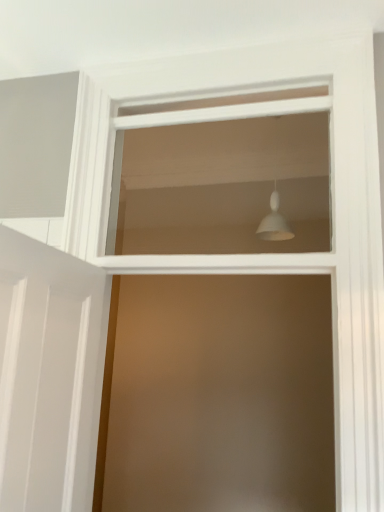
The image size is (384, 512). What are the coordinates of `white matte light fixture at upper center` in the screenshot? It's located at (274, 222).

Describe the element at coordinates (274, 222) in the screenshot. I see `white matte light fixture at upper center` at that location.

What do you see at coordinates (222, 176) in the screenshot? The height and width of the screenshot is (512, 384). I see `white matte lampshade at upper center` at bounding box center [222, 176].

The height and width of the screenshot is (512, 384). Identify the location of white matte lampshade at upper center. (222, 176).

I want to click on white matte light fixture at upper center, so click(x=274, y=222).

Would you say white matte lampshade at upper center is to the left or to the right of white matte light fixture at upper center in the picture?

From the image, it's evident that white matte lampshade at upper center is to the left of white matte light fixture at upper center.

Relative to white matte light fixture at upper center, is white matte lampshade at upper center in front or behind?

white matte lampshade at upper center is positioned closer to the viewer than white matte light fixture at upper center.

Considering the positions of points (250, 122) and (270, 228), is point (250, 122) farther from camera compared to point (270, 228)?

Yes, point (250, 122) is farther from viewer.

From the image's perspective, is white matte lampshade at upper center located beneath white matte light fixture at upper center?

Yes, from the image's perspective, white matte lampshade at upper center is below white matte light fixture at upper center.

From a real-world perspective, does white matte lampshade at upper center stand above white matte light fixture at upper center?

No, from a real-world perspective, white matte lampshade at upper center is not on top of white matte light fixture at upper center.

Considering the relative sizes of white matte lampshade at upper center and white matte light fixture at upper center in the image provided, is white matte lampshade at upper center wider than white matte light fixture at upper center?

Incorrect, the width of white matte lampshade at upper center does not surpass that of white matte light fixture at upper center.

Consider the image. Is white matte lampshade at upper center shorter than white matte light fixture at upper center?

In fact, white matte lampshade at upper center may be taller than white matte light fixture at upper center.

Considering the sizes of objects white matte lampshade at upper center and white matte light fixture at upper center in the image provided, who is smaller, white matte lampshade at upper center or white matte light fixture at upper center?

Smaller between the two is white matte light fixture at upper center.

Can white matte light fixture at upper center be found inside white matte lampshade at upper center?

No.

Does white matte lampshade at upper center touch white matte light fixture at upper center?

No, white matte lampshade at upper center is not with white matte light fixture at upper center.

Is white matte lampshade at upper center oriented away from white matte light fixture at upper center?

Correct, white matte lampshade at upper center is looking away from white matte light fixture at upper center.

Based on the photo, can you tell me how much white matte lampshade at upper center and white matte light fixture at upper center differ in facing direction?

They differ by 1.56 degrees in their facing directions.

The width and height of the screenshot is (384, 512). Find the location of `window below the white matte light fixture at upper center (from the image's perspective)`. window below the white matte light fixture at upper center (from the image's perspective) is located at coordinates (222, 176).

Is white matte light fixture at upper center to the left or to the right of white matte lampshade at upper center in the image?

white matte light fixture at upper center is to the right of white matte lampshade at upper center.

Who is more distant, white matte light fixture at upper center or white matte lampshade at upper center?

white matte light fixture at upper center is more distant.

Between point (275, 189) and point (193, 182), which one is positioned in front?

The point (275, 189) is closer.

From the image's perspective, relative to white matte lampshade at upper center, is white matte light fixture at upper center above or below?

Based on their image positions, white matte light fixture at upper center is located above white matte lampshade at upper center.

From a real-world perspective, is white matte light fixture at upper center on white matte lampshade at upper center?

Yes, from a real-world perspective, white matte light fixture at upper center is on top of white matte lampshade at upper center.

Which object is thinner, white matte light fixture at upper center or white matte lampshade at upper center?

Thinner between the two is white matte lampshade at upper center.

Is white matte light fixture at upper center shorter than white matte lampshade at upper center?

Yes, white matte light fixture at upper center is shorter than white matte lampshade at upper center.

Between white matte light fixture at upper center and white matte lampshade at upper center, which one has smaller size?

white matte light fixture at upper center.

Would you say white matte light fixture at upper center is inside or outside white matte lampshade at upper center?

white matte light fixture at upper center is outside white matte lampshade at upper center.

Looking at this image, would you say white matte light fixture at upper center is a long distance from white matte lampshade at upper center?

No, white matte light fixture at upper center is in close proximity to white matte lampshade at upper center.

Is white matte light fixture at upper center oriented towards white matte lampshade at upper center?

Yes, white matte light fixture at upper center is aimed at white matte lampshade at upper center.

How much distance is there between white matte light fixture at upper center and white matte lampshade at upper center?

They are 17.74 inches apart.

Identify the location of light fixture above the white matte lampshade at upper center (from a real-world perspective). The image size is (384, 512). (274, 222).

This screenshot has width=384, height=512. Identify the location of window below the white matte light fixture at upper center (from the image's perspective). (222, 176).

Image resolution: width=384 pixels, height=512 pixels. What are the coordinates of `light fixture that appears on the right of white matte lampshade at upper center` in the screenshot? It's located at (274, 222).